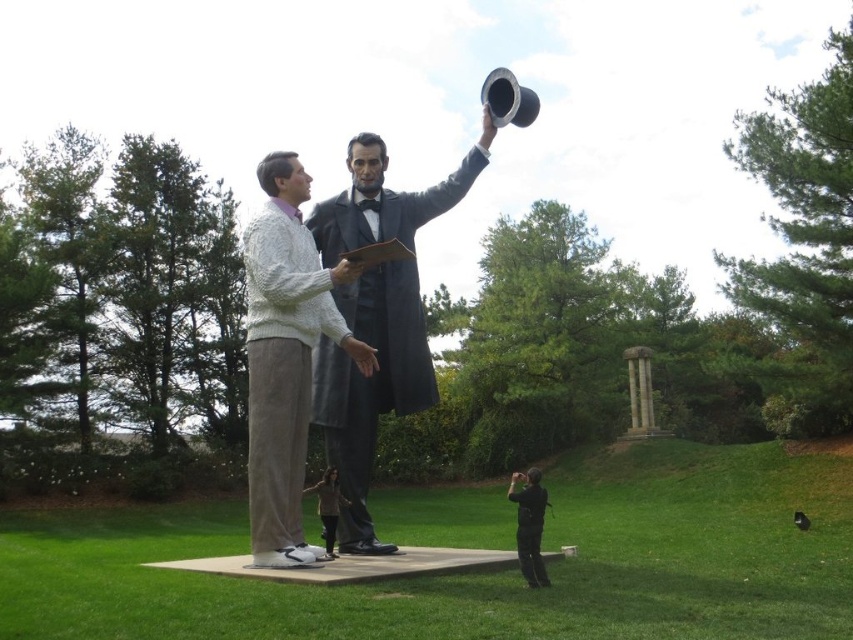
You are a photographer trying to capture a clear photo of the smooth gray suit at center without the white knitted sweater at center blocking it. Based on their positions, can you position yourself in a way to avoid the obstruction?

The white knitted sweater at center is behind the smooth gray suit at center, so if you position yourself in front of the smooth gray suit at center, you can take the photo without the white knitted sweater at center obstructing the view.

You are a fashion designer observing the outdoor scene. You need to determine which clothing item is taller between the white knitted sweater at center and the brown fabric jacket at lower center. Which one is taller?

The white knitted sweater at center is taller than the brown fabric jacket at lower center.